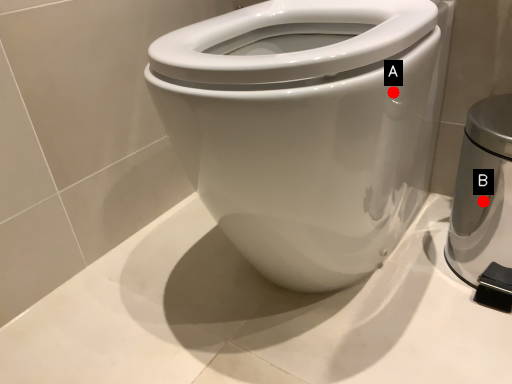
Question: Two points are circled on the image, labeled by A and B beside each circle. Which point is closer to the camera?

Choices:
 (A) A is closer
 (B) B is closer

Answer: (A)